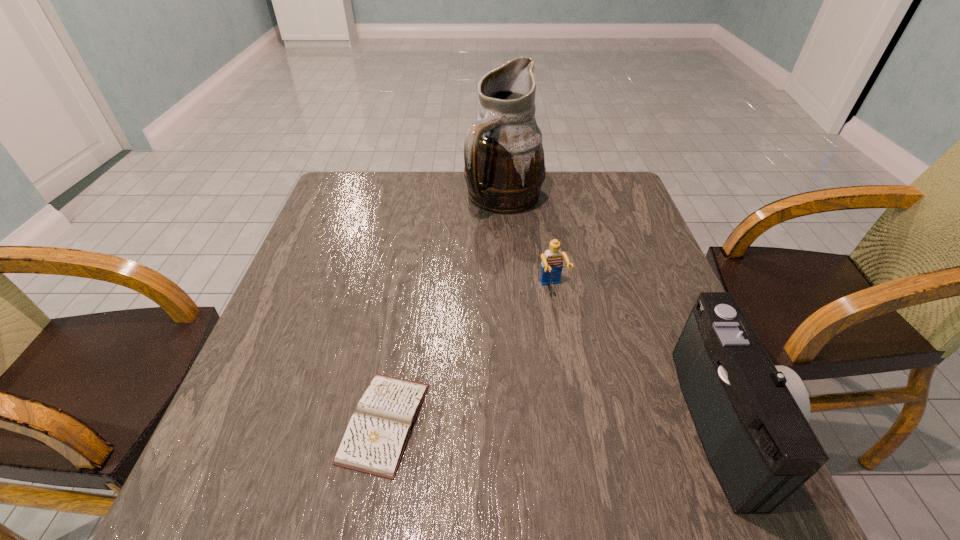
The image size is (960, 540). Identify the location of free space on the desktop that is between the leftmost object and the camcorder and is positioned on the face of the second farthest object. (606, 422).

What are the coordinates of `free space on the desktop that is between the diary and the camcorder and is positioned from the spout of the farthest object` in the screenshot? It's located at (550, 422).